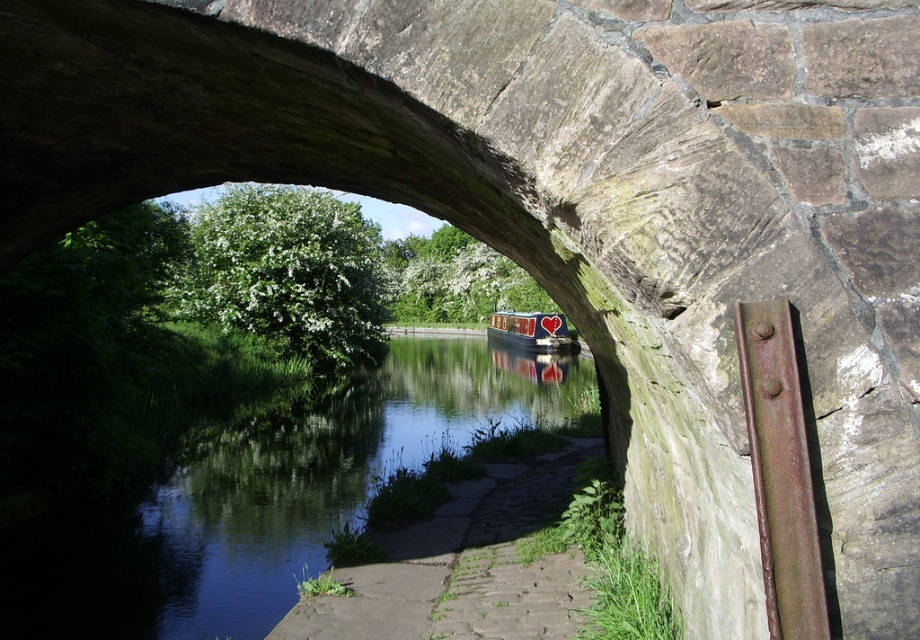
You are standing under the stone archway and want to take a photo of the canal. Which object, the green smooth water at center or the matte red canal boat at center, is positioned lower in the scene?

The green smooth water at center is located below the matte red canal boat at center, so the green smooth water at center is positioned lower in the scene.

You are standing under the stone archway and want to locate the green smooth water at center. According to the coordinates provided, where should you look relative to the archway?

The green smooth water at center is located at coordinates point (267, 497), which means it is positioned at the center of the image, slightly to the right and lower middle area relative to the archway.

You are standing under the stone archway and want to take a photo of the green smooth water at center and the matte red canal boat at center. Which object should you frame first in your camera to capture both in the same shot?

You should frame the green smooth water at center first since it is to the left of the matte red canal boat at center, allowing both to be captured in the same shot by positioning the water on the left and the boat on the right.